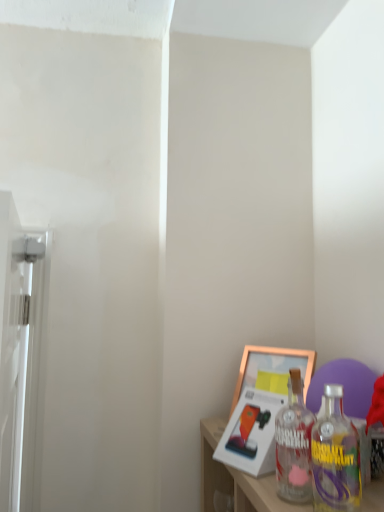
Question: Does point (38, 304) appear closer or farther from the camera than point (286, 461)?

Choices:
 (A) farther
 (B) closer

Answer: (A)

Question: From a real-world perspective, is white glossy screen door at left above or below clear glass bottle at lower right?

Choices:
 (A) below
 (B) above

Answer: (B)

Question: Estimate the real-world distances between objects in this image. Which object is closer to the gold metallic picture frame at lower right, marked as the second picture frame in a front-to-back arrangement?

Choices:
 (A) white glossy screen door at left
 (B) gold metallic picture frame at lower right, acting as the 2th picture frame starting from the back
 (C) clear glass bottle at lower right

Answer: (B)

Question: Which object is the farthest from the gold metallic picture frame at lower right, marked as the second picture frame in a front-to-back arrangement?

Choices:
 (A) gold metallic picture frame at lower right, which is counted as the first picture frame, starting from the front
 (B) clear glass bottle at lower right
 (C) white glossy screen door at left

Answer: (C)